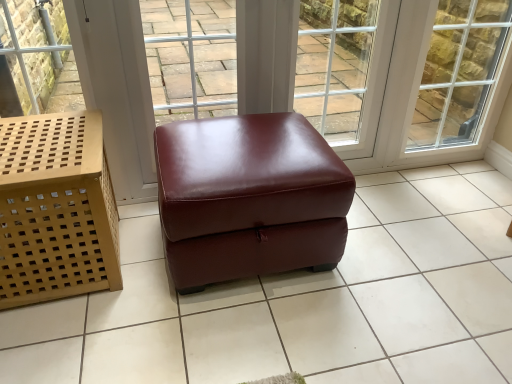
Question: Can you see clear glass window at upper right touching light brown woven basket at left?

Choices:
 (A) no
 (B) yes

Answer: (A)

Question: Is clear glass window at upper right positioned with its back to light brown woven basket at left?

Choices:
 (A) yes
 (B) no

Answer: (B)

Question: From a real-world perspective, is clear glass window at upper right physically below light brown woven basket at left?

Choices:
 (A) yes
 (B) no

Answer: (B)

Question: Considering the relative sizes of clear glass window at upper right and light brown woven basket at left in the image provided, is clear glass window at upper right shorter than light brown woven basket at left?

Choices:
 (A) yes
 (B) no

Answer: (B)

Question: Considering the relative sizes of clear glass window at upper right and light brown woven basket at left in the image provided, is clear glass window at upper right smaller than light brown woven basket at left?

Choices:
 (A) yes
 (B) no

Answer: (A)

Question: Considering the positions of burgundy leather ottoman at center and glossy leather ottoman at center in the image, is burgundy leather ottoman at center bigger or smaller than glossy leather ottoman at center?

Choices:
 (A) small
 (B) big

Answer: (B)

Question: Considering the positions of point (301, 259) and point (453, 319), is point (301, 259) closer or farther from the camera than point (453, 319)?

Choices:
 (A) closer
 (B) farther

Answer: (B)

Question: Relative to glossy leather ottoman at center, is burgundy leather ottoman at center in front or behind?

Choices:
 (A) behind
 (B) front

Answer: (A)

Question: Which is correct: burgundy leather ottoman at center is inside glossy leather ottoman at center, or outside of it?

Choices:
 (A) outside
 (B) inside

Answer: (A)

Question: Would you say light brown woven basket at left is to the left or to the right of clear glass window at upper right in the picture?

Choices:
 (A) right
 (B) left

Answer: (B)

Question: Is light brown woven basket at left situated inside clear glass window at upper right or outside?

Choices:
 (A) inside
 (B) outside

Answer: (B)

Question: From a real-world perspective, is light brown woven basket at left physically located above or below clear glass window at upper right?

Choices:
 (A) below
 (B) above

Answer: (A)

Question: In terms of size, does light brown woven basket at left appear bigger or smaller than clear glass window at upper right?

Choices:
 (A) big
 (B) small

Answer: (A)

Question: From the image's perspective, is light brown woven basket at left above or below glossy leather ottoman at center?

Choices:
 (A) above
 (B) below

Answer: (A)

Question: In terms of size, does light brown woven basket at left appear bigger or smaller than glossy leather ottoman at center?

Choices:
 (A) small
 (B) big

Answer: (A)